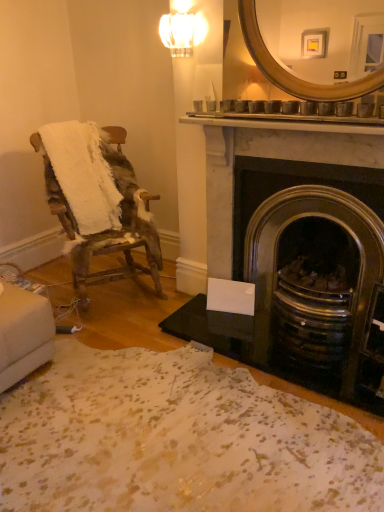
Question: From the image's perspective, is gold metallic mirror at upper center below clear glass sconce at upper center?

Choices:
 (A) no
 (B) yes

Answer: (B)

Question: Does gold metallic mirror at upper center have a lesser width compared to clear glass sconce at upper center?

Choices:
 (A) no
 (B) yes

Answer: (A)

Question: Does gold metallic mirror at upper center lie behind clear glass sconce at upper center?

Choices:
 (A) yes
 (B) no

Answer: (B)

Question: Can you confirm if gold metallic mirror at upper center is wider than clear glass sconce at upper center?

Choices:
 (A) no
 (B) yes

Answer: (B)

Question: Does gold metallic mirror at upper center touch clear glass sconce at upper center?

Choices:
 (A) yes
 (B) no

Answer: (B)

Question: In the image, is dark gray stone fireplace at center right positioned in front of or behind clear glass sconce at upper center?

Choices:
 (A) front
 (B) behind

Answer: (A)

Question: Is dark gray stone fireplace at center right spatially inside clear glass sconce at upper center, or outside of it?

Choices:
 (A) inside
 (B) outside

Answer: (B)

Question: From a real-world perspective, is dark gray stone fireplace at center right positioned above or below clear glass sconce at upper center?

Choices:
 (A) above
 (B) below

Answer: (B)

Question: From the image's perspective, relative to clear glass sconce at upper center, is dark gray stone fireplace at center right above or below?

Choices:
 (A) above
 (B) below

Answer: (B)

Question: Considering the positions of clear glass sconce at upper center and dark gray stone fireplace at center right in the image, is clear glass sconce at upper center taller or shorter than dark gray stone fireplace at center right?

Choices:
 (A) tall
 (B) short

Answer: (B)

Question: Is point (185, 23) positioned closer to the camera than point (240, 146)?

Choices:
 (A) farther
 (B) closer

Answer: (B)

Question: Considering the positions of clear glass sconce at upper center and dark gray stone fireplace at center right in the image, is clear glass sconce at upper center bigger or smaller than dark gray stone fireplace at center right?

Choices:
 (A) big
 (B) small

Answer: (B)

Question: From a real-world perspective, is clear glass sconce at upper center above or below dark gray stone fireplace at center right?

Choices:
 (A) below
 (B) above

Answer: (B)

Question: From a real-world perspective, is gold metallic mirror at upper center above or below dark gray stone fireplace at center right?

Choices:
 (A) below
 (B) above

Answer: (B)

Question: Does point (296, 14) appear closer or farther from the camera than point (362, 151)?

Choices:
 (A) farther
 (B) closer

Answer: (B)